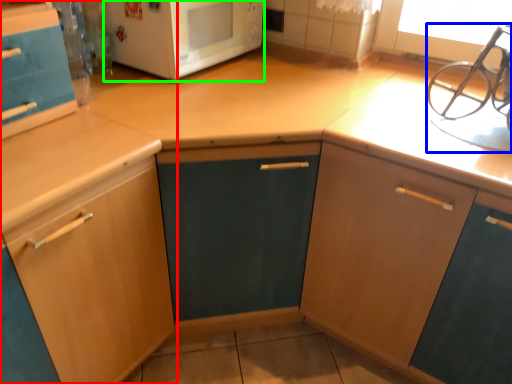
Question: Considering the real-world distances, which object is farthest from cabinetry (highlighted by a red box)? sink (highlighted by a blue box) or microwave oven (highlighted by a green box)?

Choices:
 (A) sink
 (B) microwave oven

Answer: (A)